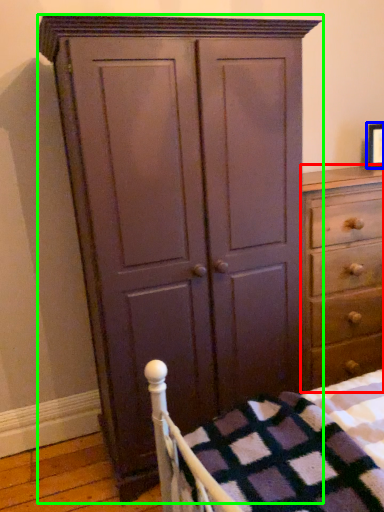
Question: Estimate the real-world distances between objects in this image. Which object is farther from chest of drawers (highlighted by a red box), picture frame (highlighted by a blue box) or cupboard (highlighted by a green box)?

Choices:
 (A) picture frame
 (B) cupboard

Answer: (A)